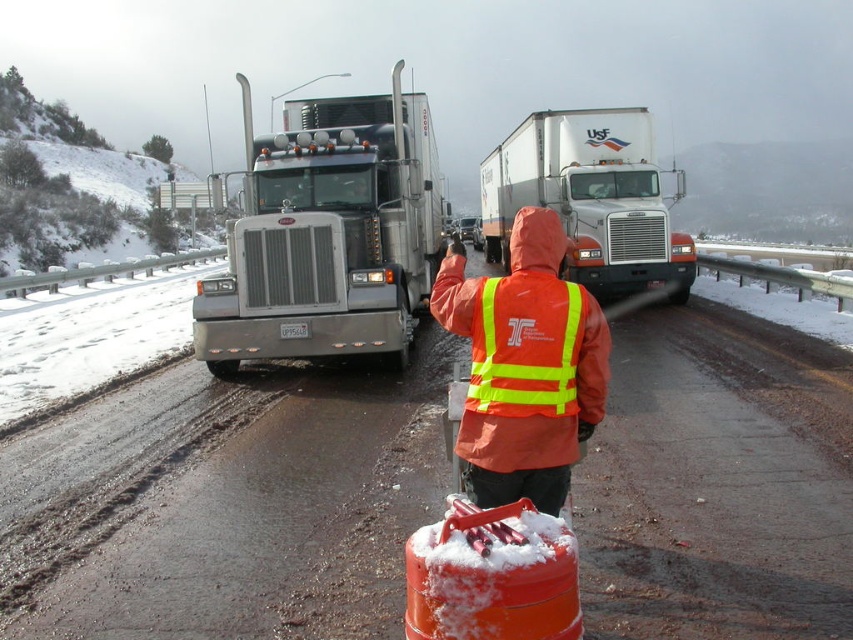
Is silver metallic truck at center bigger than white glossy truck at upper center?

Indeed, silver metallic truck at center has a larger size compared to white glossy truck at upper center.

Measure the distance between silver metallic truck at center and white glossy truck at upper center.

silver metallic truck at center and white glossy truck at upper center are 9.49 meters apart from each other.

Who is more forward, (309, 332) or (514, 200)?

Point (309, 332) is in front.

In order to click on silver metallic truck at center in this screenshot , I will do `click(328, 234)`.

Between orange reflective vest at center and orange reflective safety vest at center, which one is positioned higher?

orange reflective safety vest at center

Is orange reflective vest at center thinner than orange reflective safety vest at center?

Incorrect, orange reflective vest at center's width is not less than orange reflective safety vest at center's.

Is point (737, 445) more distant than point (518, 296)?

Yes, it is.

Identify the location of orange reflective vest at center. (274, 518).

Between white glossy truck at upper center and orange reflective safety vest at center, which one has more height?

white glossy truck at upper center is taller.

Can you confirm if white glossy truck at upper center is positioned above orange reflective safety vest at center?

Yes.

The image size is (853, 640). Identify the location of white glossy truck at upper center. (589, 198).

The height and width of the screenshot is (640, 853). I want to click on white glossy truck at upper center, so click(589, 198).